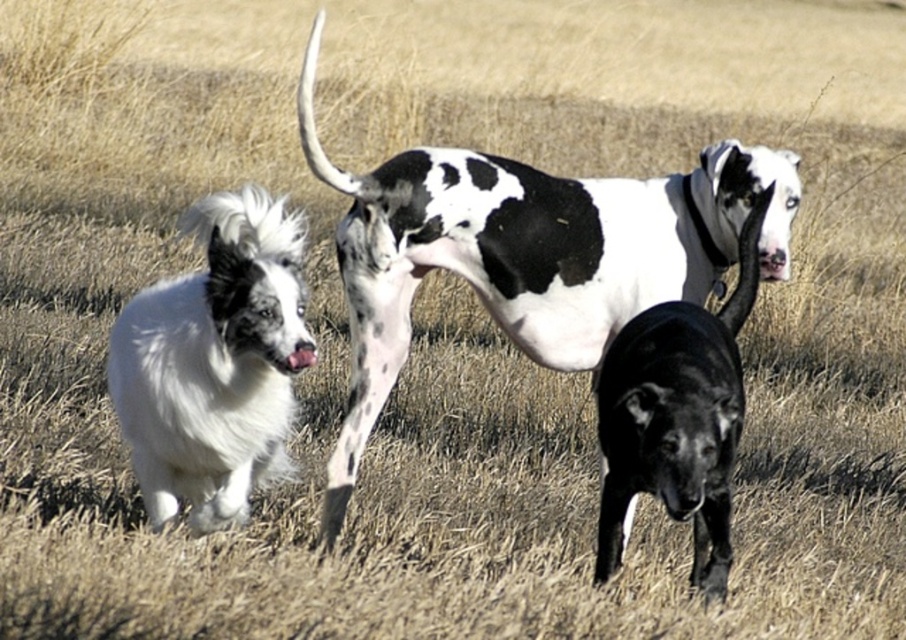
You are a photographer holding a camera that requires a minimum distance of 1.2 meters between subjects to capture both clearly. You see the white fluffy dog at left and the black glossy dog at center. Can you take a photo of both dogs without them overlapping in the frame?

The distance between the white fluffy dog at left and black glossy dog at center is 1.16 meters, which is less than the required 1.2 meters. Therefore, you cannot take a photo of both dogs without them overlapping in the frame.